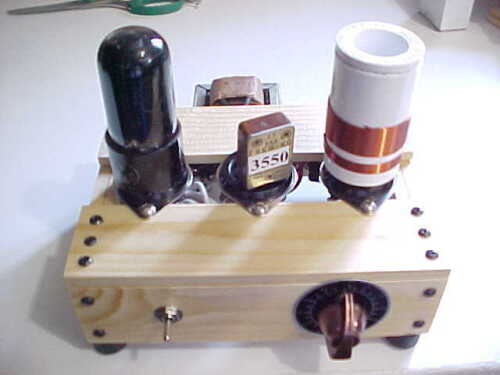
This screenshot has width=500, height=375. Find the location of `copper knob`. copper knob is located at coordinates (353, 322).